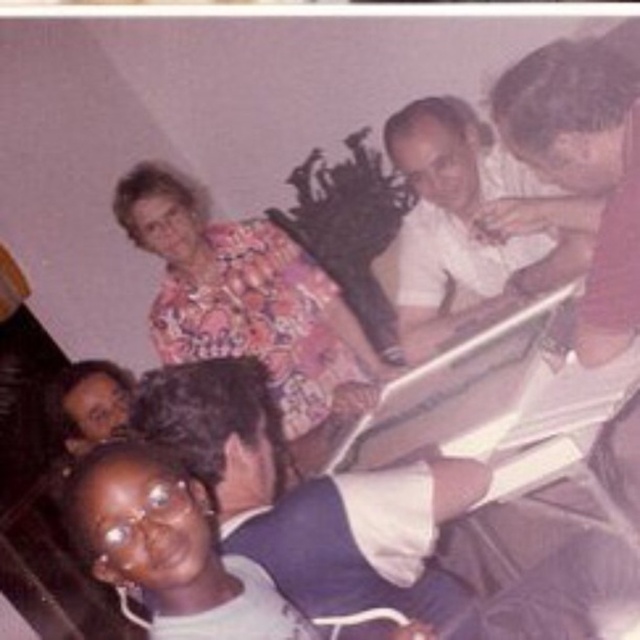
Question: Which object is the closest to the matte floral blouse at lower left?

Choices:
 (A) floral fabric blouse at upper center
 (B) matte white shirt at upper right
 (C) blue fabric shirt at lower left

Answer: (A)

Question: Which object is positioned closest to the matte floral blouse at lower left?

Choices:
 (A) floral fabric blouse at upper center
 (B) blue fabric shirt at lower left
 (C) matte white shirt at upper right

Answer: (A)

Question: Is floral fabric blouse at upper center bigger than matte floral blouse at lower left?

Choices:
 (A) yes
 (B) no

Answer: (A)

Question: Is floral fabric blouse at upper center smaller than matte floral blouse at lower left?

Choices:
 (A) no
 (B) yes

Answer: (A)

Question: Is blue fabric shirt at lower left smaller than matte white shirt at upper right?

Choices:
 (A) yes
 (B) no

Answer: (A)

Question: Which is farther from the matte white shirt at upper right?

Choices:
 (A) matte floral blouse at lower left
 (B) blue fabric shirt at lower left

Answer: (A)